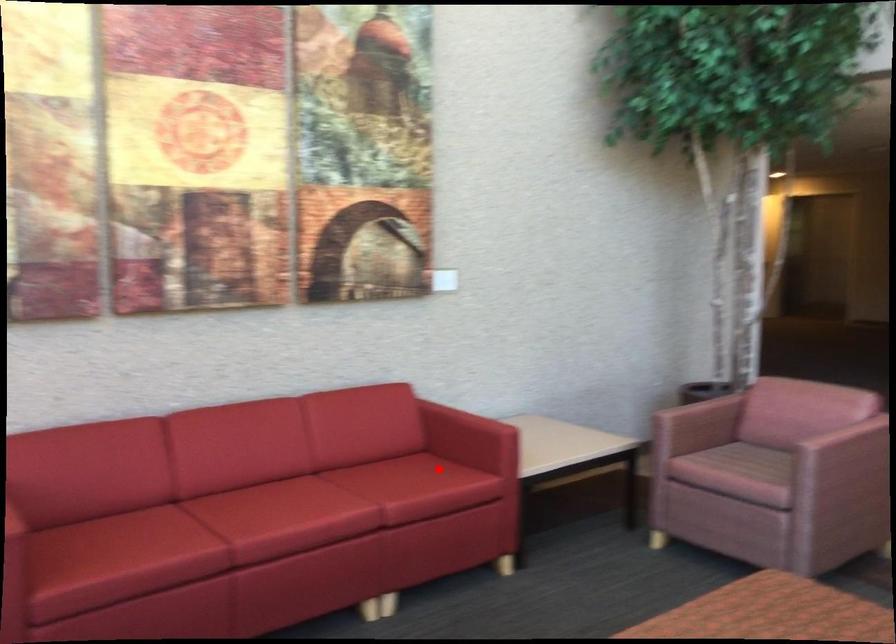
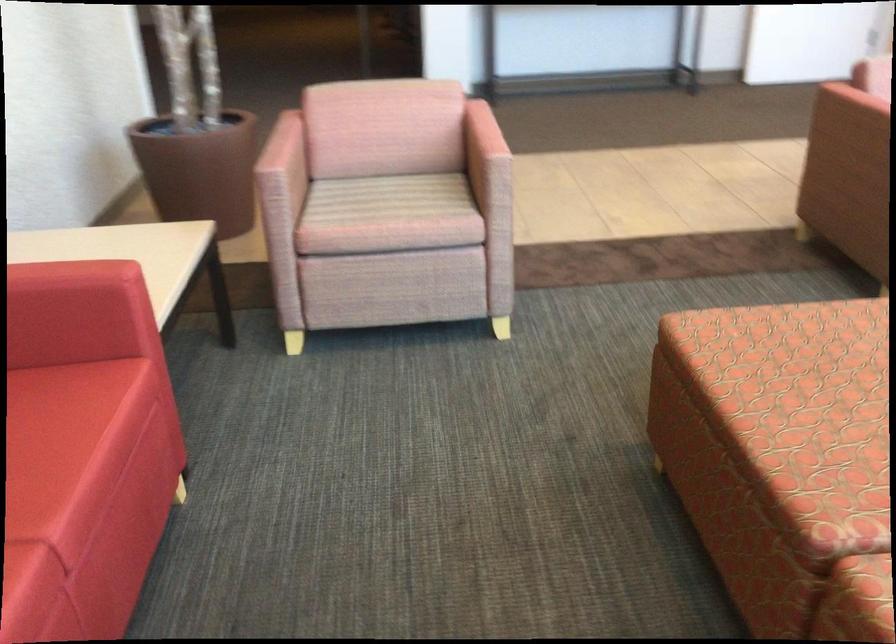
Question: I am providing you with two images of the same scene from different viewpoints. A red point is marked on the first image. Is the red point's position out of view in image 2?

Choices:
 (A) Yes
 (B) No

Answer: (B)